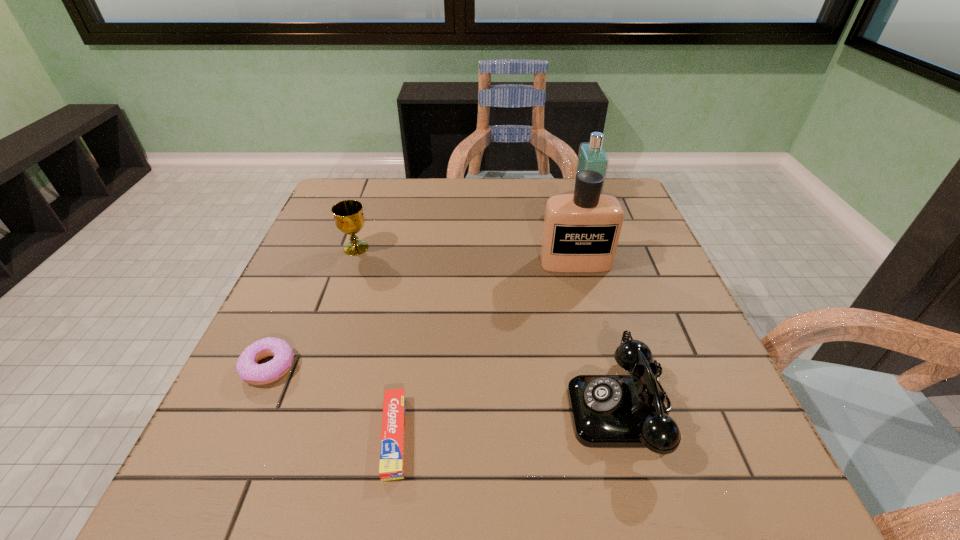
Find the location of a particular element. empty space between the tallest object and the fifth tallest object is located at coordinates (422, 314).

The width and height of the screenshot is (960, 540). Identify the location of free spot between the fourth object from right to left and the taller perfume. (485, 349).

Identify which object is located as the fourth nearest to the fifth tallest object. Please provide its 2D coordinates. Your answer should be formatted as a tuple, i.e. [(x, y)], where the tuple contains the x and y coordinates of a point satisfying the conditions above.

[(581, 231)]

Where is `object that ranks as the second closest to the nearer perfume`? The width and height of the screenshot is (960, 540). object that ranks as the second closest to the nearer perfume is located at coordinates (608, 411).